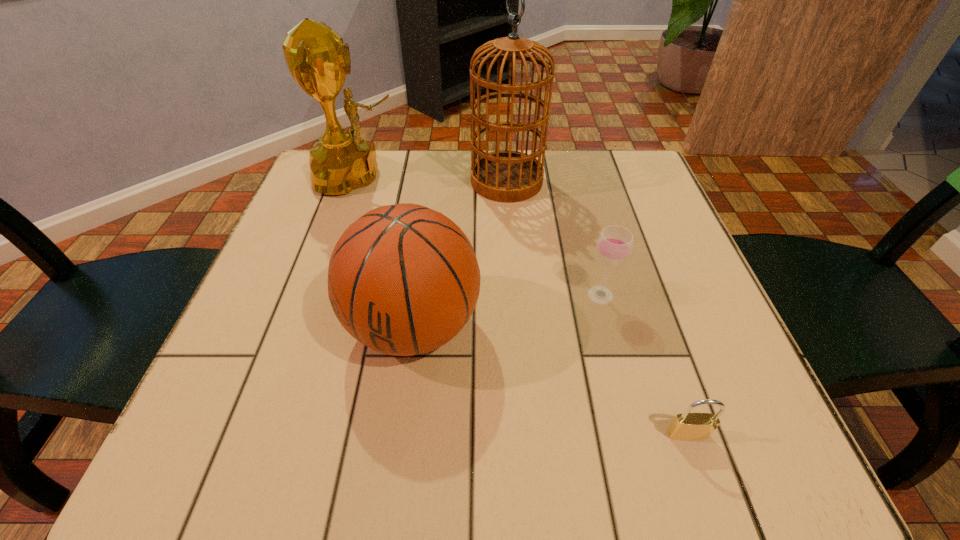
Identify the location of birdcage. Image resolution: width=960 pixels, height=540 pixels. (508, 176).

This screenshot has height=540, width=960. I want to click on the second tallest object, so click(318, 60).

Find the location of a particular element. This screenshot has height=540, width=960. basketball is located at coordinates (403, 279).

Identify the location of the fourth object from left to right. click(x=614, y=245).

Find the location of a particular element. the second shortest object is located at coordinates (614, 245).

This screenshot has width=960, height=540. I want to click on the rightmost object, so click(687, 426).

This screenshot has height=540, width=960. Identify the location of the shortest object. (687, 426).

Locate an element on the screen. Image resolution: width=960 pixels, height=540 pixels. free point located on the right of the birdcage is located at coordinates (592, 181).

Identify the location of free spot located on the front side of the award. The image size is (960, 540). (523, 177).

Locate an element on the screen. free space located 0.180m on the back of the third tallest object is located at coordinates (428, 219).